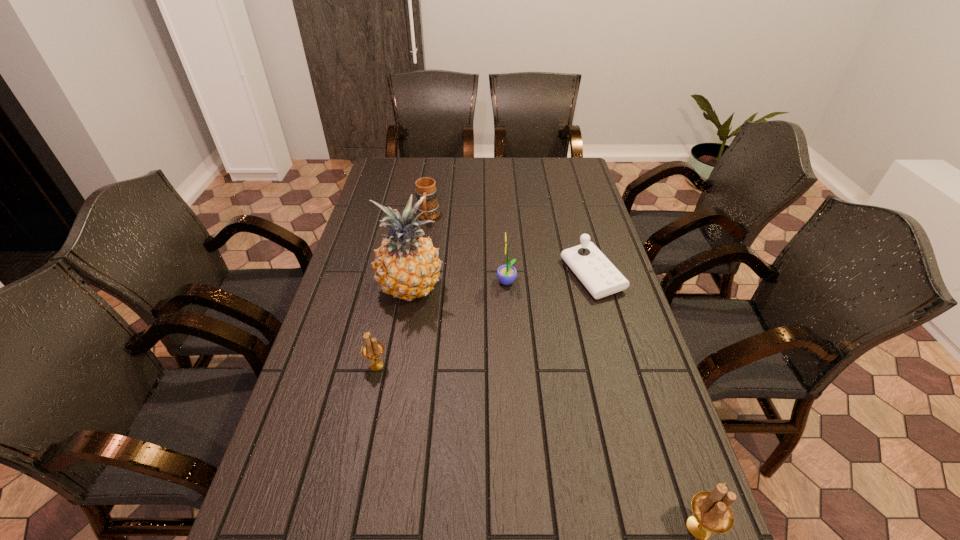
If we want them evenly spaced by inserting an extra candle_holder among them, please locate a free spot for this new candle_holder. Please provide its 2D coordinates. Your answer should be formatted as a tuple, i.e. [(x, y)], where the tuple contains the x and y coordinates of a point satisfying the conditions above.

[(515, 435)]